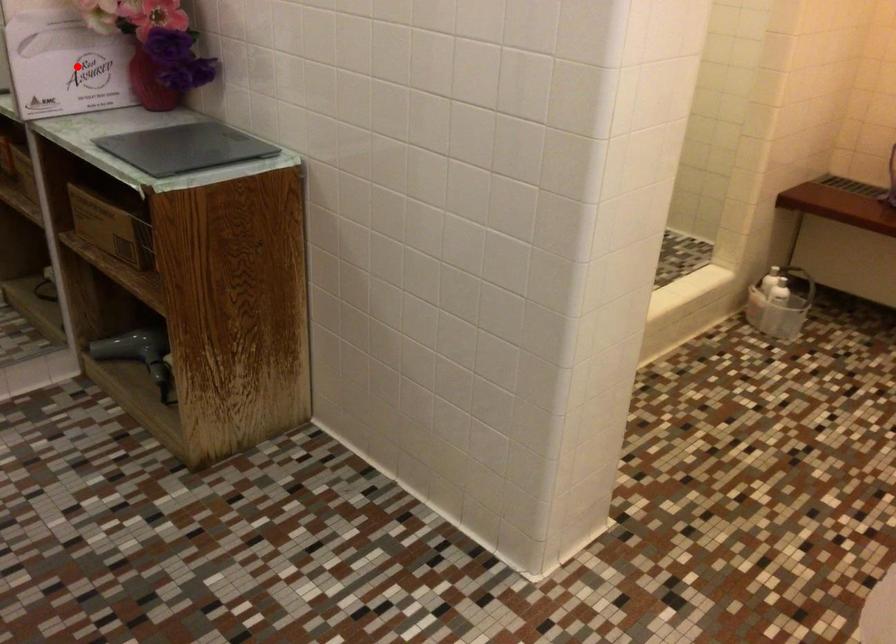
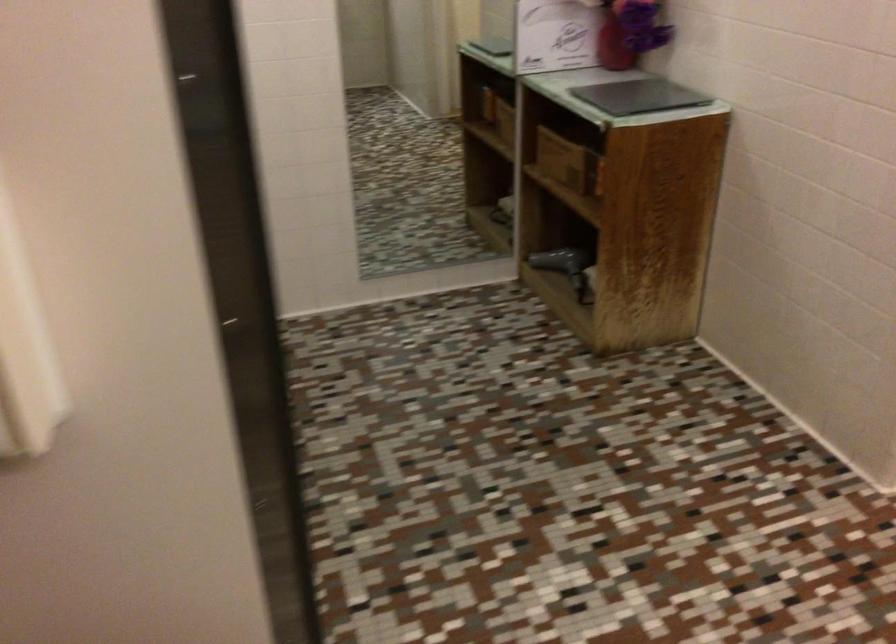
Locate, in the second image, the point that corresponds to the highlighted location in the first image.

(556, 35)